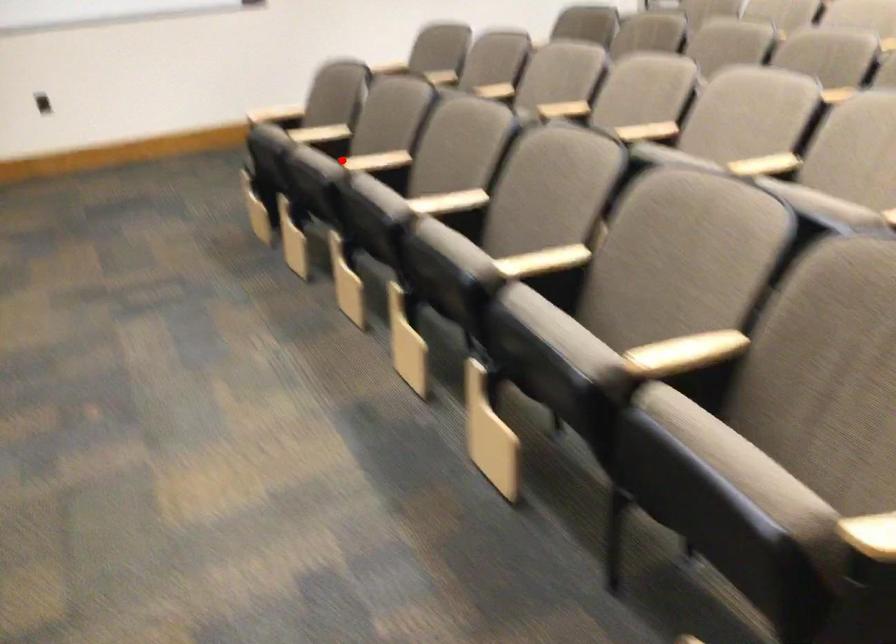
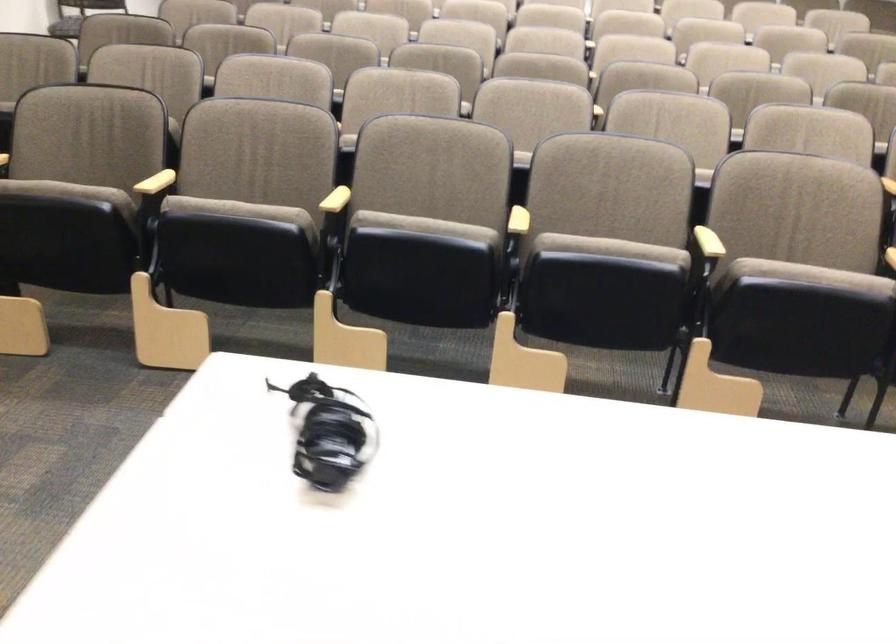
The point at the highlighted location is marked in the first image. Where is the corresponding point in the second image?

(336, 200)